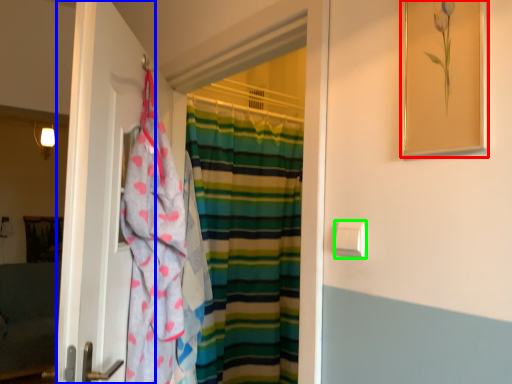
Question: Based on their relative distances, which object is nearer to picture frame (highlighted by a red box)? Choose from door (highlighted by a blue box) and towel bar (highlighted by a green box).

Choices:
 (A) door
 (B) towel bar

Answer: (B)